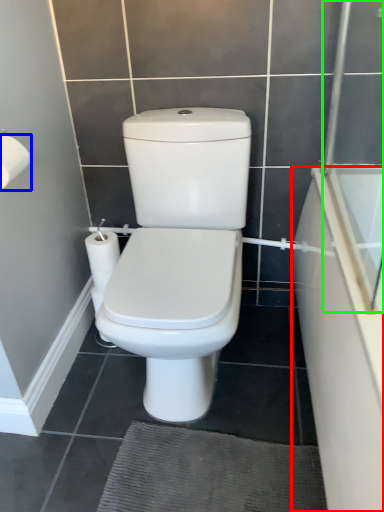
Question: Which object is the closest to the bath (highlighted by a red box)? Choose among these: toilet paper (highlighted by a blue box) or screen door (highlighted by a green box).

Choices:
 (A) toilet paper
 (B) screen door

Answer: (B)